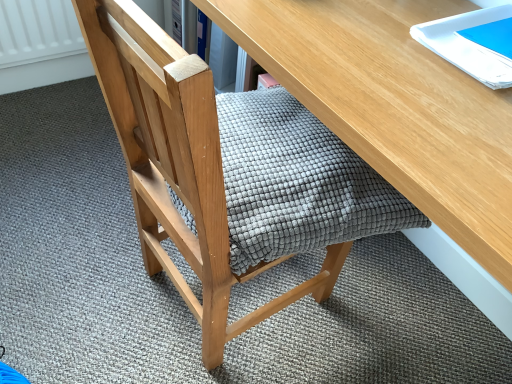
Question: Is textured gray cushion at center inside the boundaries of wooden desk at center, or outside?

Choices:
 (A) outside
 (B) inside

Answer: (B)

Question: In the image, is textured gray cushion at center on the left side or the right side of wooden desk at center?

Choices:
 (A) right
 (B) left

Answer: (B)

Question: Based on their relative distances, which object is farther from the wooden desk at center?

Choices:
 (A) white glossy notebook at upper right
 (B) textured gray cushion at center

Answer: (B)

Question: Which is farther from the white glossy notebook at upper right?

Choices:
 (A) textured gray cushion at center
 (B) wooden desk at center

Answer: (A)